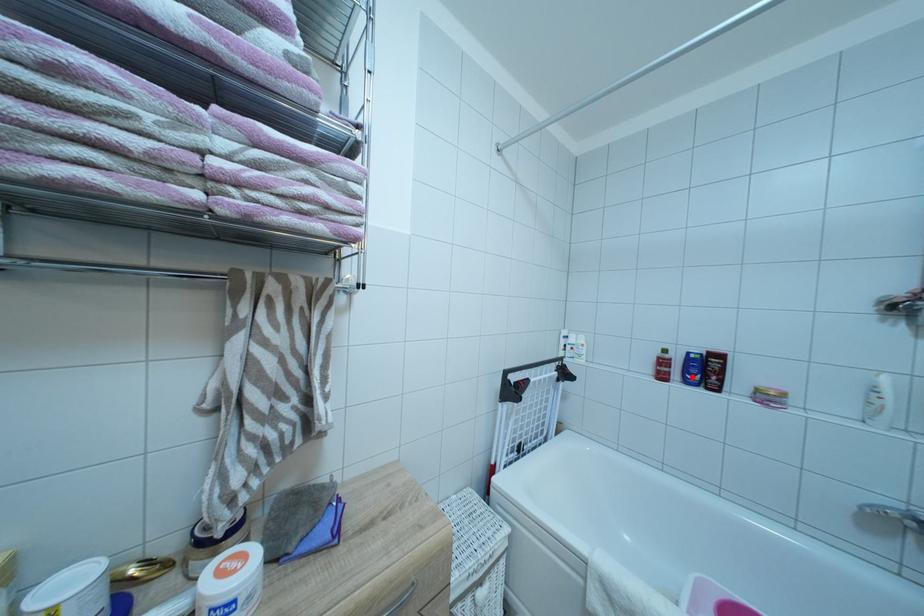
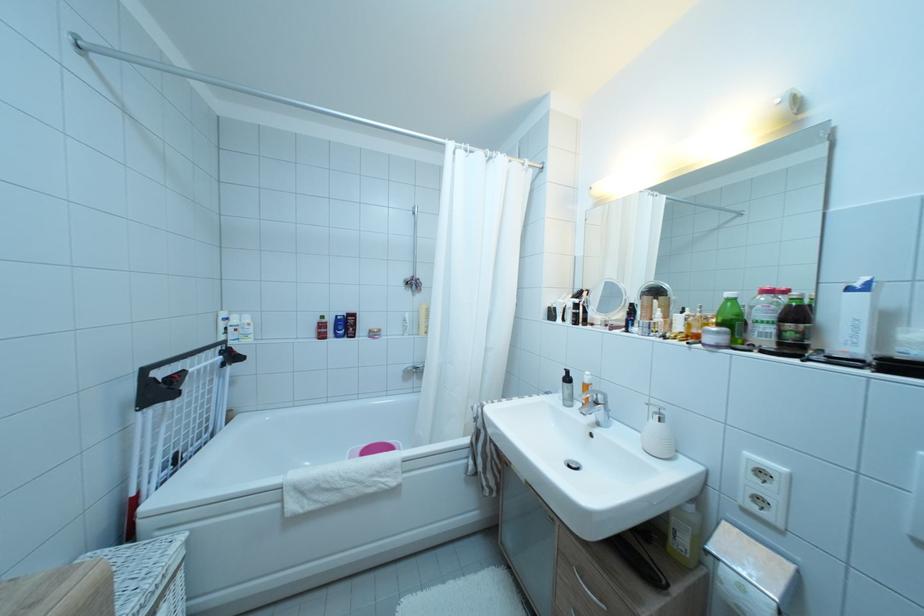
Find the pixel in the second image that matches the highlighted location in the first image.

(343, 334)